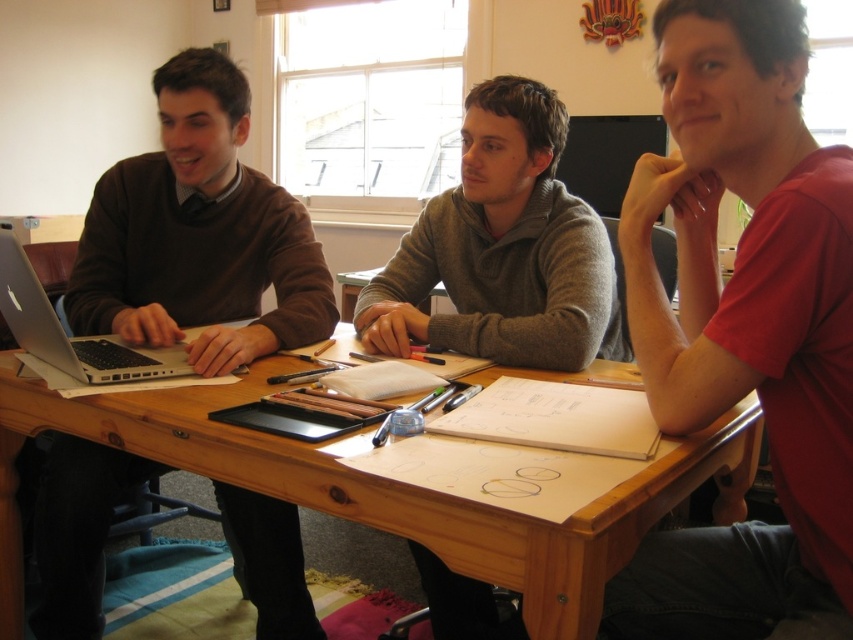
You are standing at the entrance of the room and see the silver metallic laptop at left on the table. If you walk straight towards the table, will the laptop be to your left or right side when you reach it?

The silver metallic laptop at left is located at point (73, 337), which places it on the left side of the table. When approaching the table straight from the entrance, the laptop would be on your left side.

You are observing a group of people around a table. There is a red matte shirt at center and a black matte monitor at center. Which object is positioned closer to you?

The red matte shirt at center is closer to the viewer than the black matte monitor at center.

You are a student sitting at the table and need to access both the silver metallic laptop at left and the black matte monitor at center. Which device should you reach for first if you want to grab the one closer to your right side?

The black matte monitor at center is to the right of the silver metallic laptop at left, so you should reach for the black matte monitor at center first if you want the one closer to your right side.